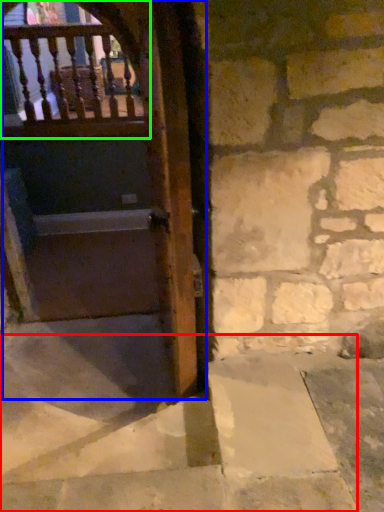
Question: Which is nearer to the stairwell (highlighted by a red box)? door (highlighted by a blue box) or balcony (highlighted by a green box).

Choices:
 (A) door
 (B) balcony

Answer: (A)